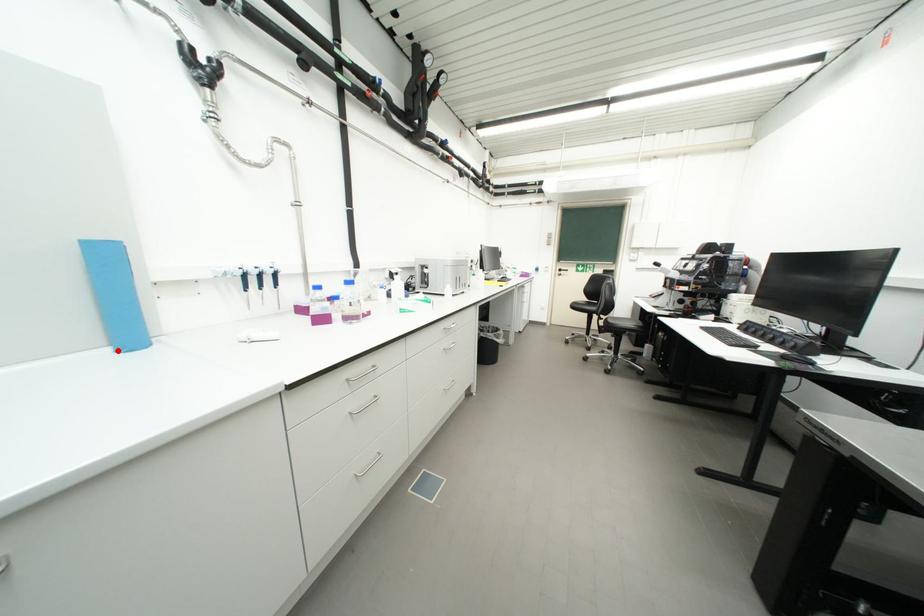
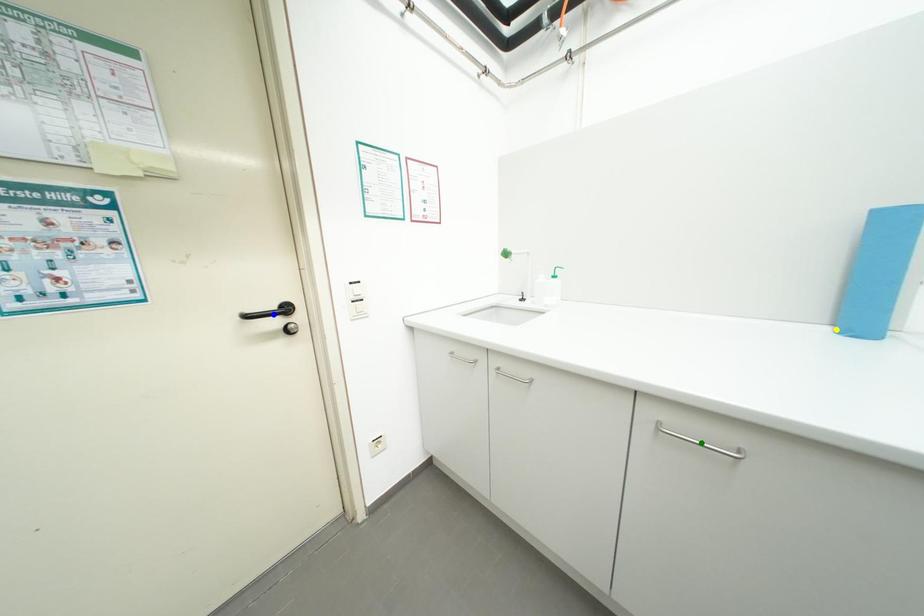
Question: I am providing you with two images of the same scene from different viewpoints. A red point is marked on the first image. You are given multiple points on the second image. In image 2, which mark is for the same physical point as the one in image 1?

Choices:
 (A) yellow point
 (B) green point
 (C) blue point

Answer: (A)